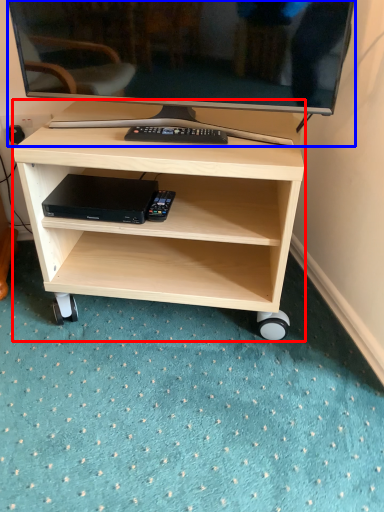
Question: Among these objects, which one is nearest to the camera, desk (highlighted by a red box) or television (highlighted by a blue box)?

Choices:
 (A) desk
 (B) television

Answer: (B)